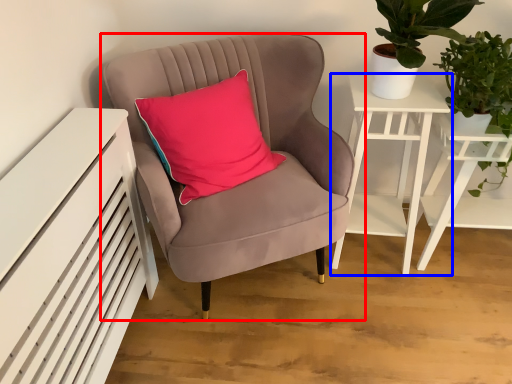
Question: Which of the following is the farthest to the observer, chair (highlighted by a red box) or nightstand (highlighted by a blue box)?

Choices:
 (A) chair
 (B) nightstand

Answer: (B)